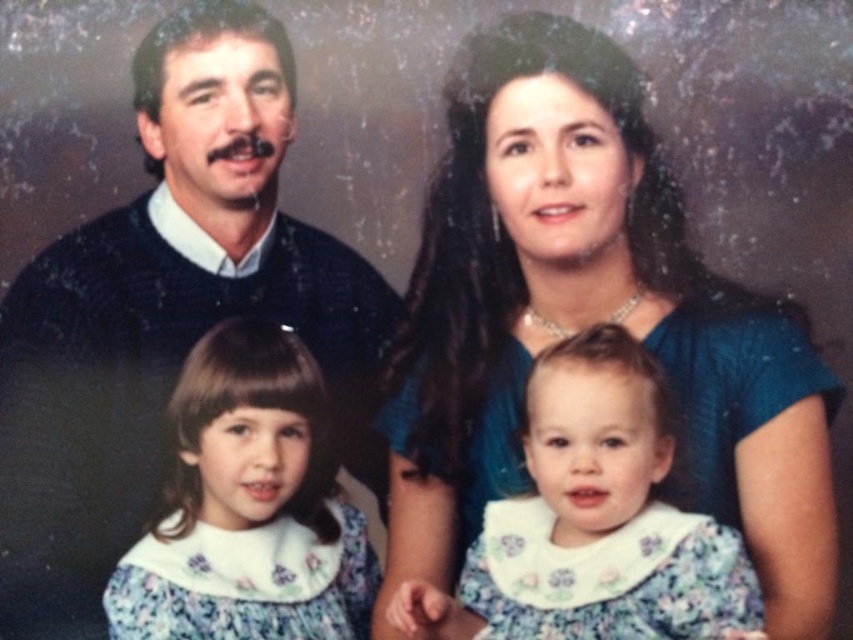
In the family portrait, you notice the blue satin dress at upper center and the floral fabric dress at lower left. Which dress has a greater width?

The blue satin dress at upper center has a greater width than the floral fabric dress at lower left.

You are an interior designer planning to place two dresses in a display case. The blue satin dress at upper center and the floral fabric dress at center need to be arranged vertically. Given that the display case has limited vertical space, which dress should be placed higher up to ensure both fit without overlapping?

The blue satin dress at upper center should be placed higher up in the display case since it is taller than the floral fabric dress at center, allowing both to fit vertically without overlapping.